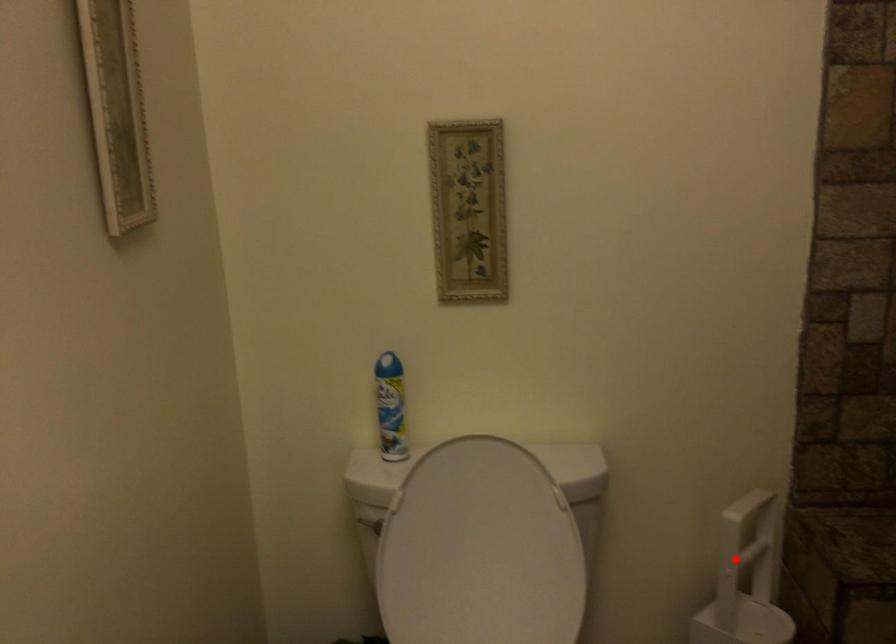
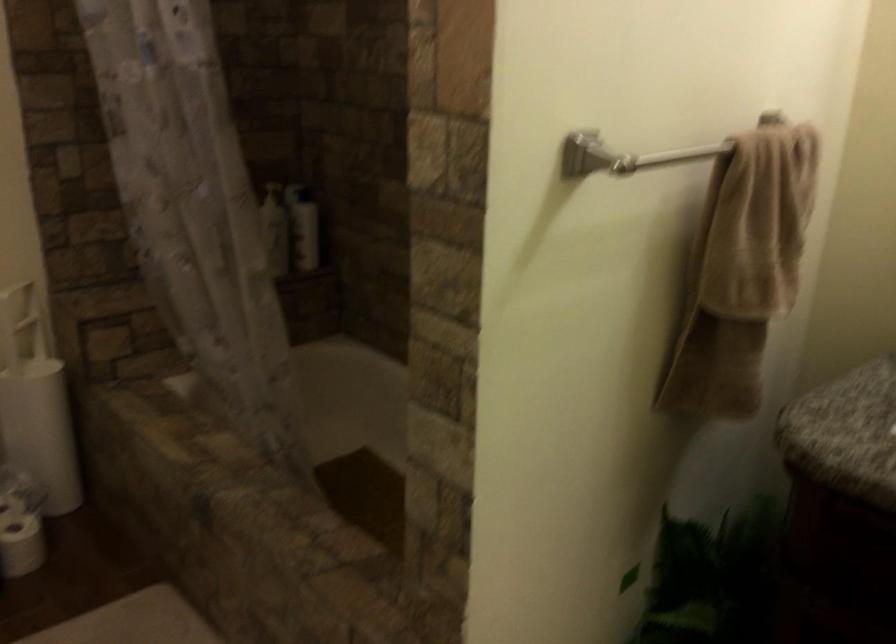
Question: I am providing you with two images of the same scene from different viewpoints. Given a red point in image1, look at the same physical point in image2. Is it:

Choices:
 (A) Closer to the viewpoint
 (B) Farther from the viewpoint

Answer: (B)